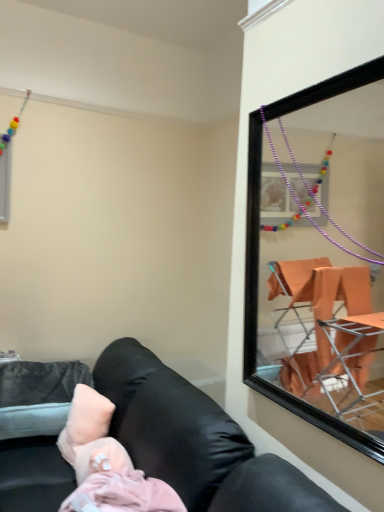
Question: From a real-world perspective, is black leather couch at lower left under pink fabric pillow at lower left?

Choices:
 (A) yes
 (B) no

Answer: (A)

Question: Is black leather couch at lower left surrounding pink fabric pillow at lower left?

Choices:
 (A) yes
 (B) no

Answer: (A)

Question: Considering the relative positions of black leather couch at lower left and pink fabric pillow at lower left in the image provided, is black leather couch at lower left to the left of pink fabric pillow at lower left from the viewer's perspective?

Choices:
 (A) yes
 (B) no

Answer: (B)

Question: Can you confirm if black leather couch at lower left is taller than pink fabric pillow at lower left?

Choices:
 (A) yes
 (B) no

Answer: (A)

Question: Is black leather couch at lower left smaller than pink fabric pillow at lower left?

Choices:
 (A) no
 (B) yes

Answer: (A)

Question: Looking at their shapes, would you say black leather couch at lower left is wider or thinner than pink fabric pillow at lower left?

Choices:
 (A) wide
 (B) thin

Answer: (A)

Question: From a real-world perspective, is black leather couch at lower left physically located above or below pink fabric pillow at lower left?

Choices:
 (A) below
 (B) above

Answer: (A)

Question: Is black leather couch at lower left bigger or smaller than pink fabric pillow at lower left?

Choices:
 (A) big
 (B) small

Answer: (A)

Question: Relative to pink fabric pillow at lower left, is black leather couch at lower left in front or behind?

Choices:
 (A) front
 (B) behind

Answer: (A)

Question: Considering the positions of pink fabric pillow at lower left and black leather couch at lower left in the image, is pink fabric pillow at lower left taller or shorter than black leather couch at lower left?

Choices:
 (A) tall
 (B) short

Answer: (B)

Question: From a real-world perspective, is pink fabric pillow at lower left positioned above or below black leather couch at lower left?

Choices:
 (A) above
 (B) below

Answer: (A)

Question: Is pink fabric pillow at lower left in front of or behind black leather couch at lower left in the image?

Choices:
 (A) front
 (B) behind

Answer: (B)

Question: Based on their positions, is pink fabric pillow at lower left located to the left or right of black leather couch at lower left?

Choices:
 (A) right
 (B) left

Answer: (B)

Question: Considering the positions of black leather couch at lower left and pink fabric at lower left in the image, is black leather couch at lower left wider or thinner than pink fabric at lower left?

Choices:
 (A) thin
 (B) wide

Answer: (B)

Question: Visually, is black leather couch at lower left positioned to the left or to the right of pink fabric at lower left?

Choices:
 (A) right
 (B) left

Answer: (B)